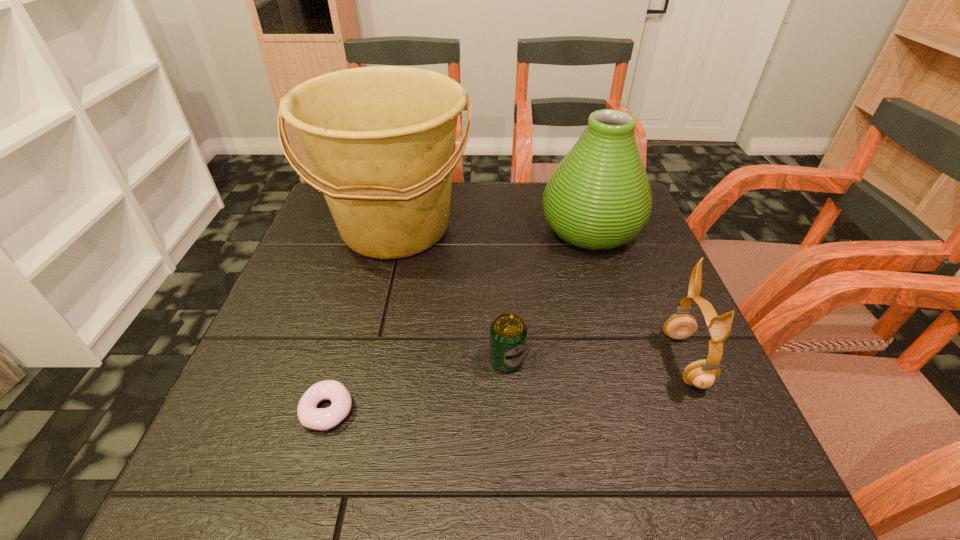
Image resolution: width=960 pixels, height=540 pixels. I want to click on vacant space that satisfies the following two spatial constraints: 1. on the back side of the third object from left to right; 2. on the right side of the second tallest object, so click(x=499, y=228).